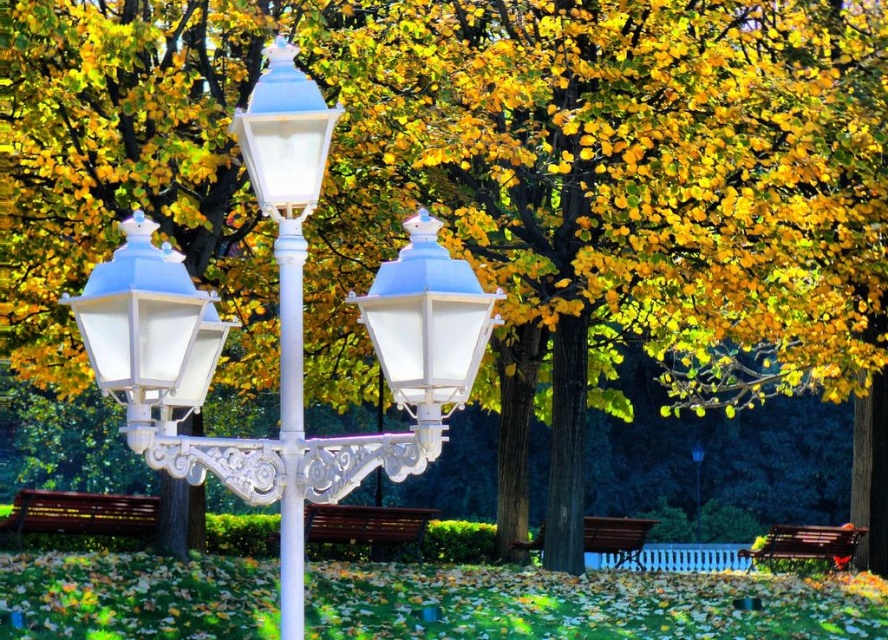
Does matte white lantern at center come behind white porcelain street light at center?

No.

Who is more distant from viewer, (469, 268) or (703, 454)?

The point (703, 454) is more distant.

This screenshot has width=888, height=640. I want to click on matte white lantern at center, so click(427, 326).

I want to click on matte white lantern at left, so click(x=148, y=332).

Describe the element at coordinates (148, 332) in the screenshot. I see `matte white lantern at left` at that location.

Where is `matte white lantern at left`? Image resolution: width=888 pixels, height=640 pixels. matte white lantern at left is located at coordinates (148, 332).

Does white glossy streetlight at center come in front of white glossy street light at center?

That is True.

Who is positioned more to the right, white glossy streetlight at center or white glossy street light at center?

white glossy street light at center

The height and width of the screenshot is (640, 888). What do you see at coordinates (282, 333) in the screenshot?
I see `white glossy streetlight at center` at bounding box center [282, 333].

The image size is (888, 640). In order to click on white glossy streetlight at center in this screenshot , I will do `click(282, 333)`.